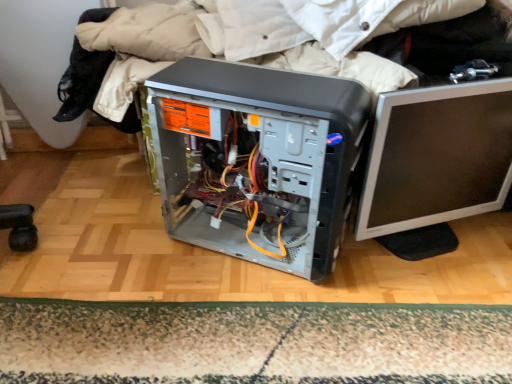
Question: Can you confirm if silver/black plastic monitor at right is taller than carpeted mat at lower center?

Choices:
 (A) yes
 (B) no

Answer: (A)

Question: From the image's perspective, does silver/black plastic monitor at right appear lower than carpeted mat at lower center?

Choices:
 (A) no
 (B) yes

Answer: (A)

Question: Does silver/black plastic monitor at right come in front of carpeted mat at lower center?

Choices:
 (A) yes
 (B) no

Answer: (A)

Question: Considering the relative sizes of silver/black plastic monitor at right and carpeted mat at lower center in the image provided, is silver/black plastic monitor at right smaller than carpeted mat at lower center?

Choices:
 (A) no
 (B) yes

Answer: (A)

Question: From a real-world perspective, is silver/black plastic monitor at right on carpeted mat at lower center?

Choices:
 (A) no
 (B) yes

Answer: (B)

Question: In terms of size, does silver/black plastic monitor at right appear bigger or smaller than satin black computer tower at center?

Choices:
 (A) big
 (B) small

Answer: (B)

Question: Does point (423, 233) appear closer or farther from the camera than point (261, 223)?

Choices:
 (A) farther
 (B) closer

Answer: (B)

Question: Is silver/black plastic monitor at right taller or shorter than satin black computer tower at center?

Choices:
 (A) short
 (B) tall

Answer: (A)

Question: Relative to satin black computer tower at center, is silver/black plastic monitor at right in front or behind?

Choices:
 (A) front
 (B) behind

Answer: (B)

Question: Is silver/black plastic monitor at right bigger or smaller than carpeted mat at lower center?

Choices:
 (A) big
 (B) small

Answer: (A)

Question: In terms of height, does silver/black plastic monitor at right look taller or shorter compared to carpeted mat at lower center?

Choices:
 (A) short
 (B) tall

Answer: (B)

Question: Is silver/black plastic monitor at right in front of or behind carpeted mat at lower center in the image?

Choices:
 (A) front
 (B) behind

Answer: (A)

Question: Do you think silver/black plastic monitor at right is within carpeted mat at lower center, or outside of it?

Choices:
 (A) outside
 (B) inside

Answer: (A)

Question: Considering the relative positions of satin black computer tower at center and carpeted mat at lower center in the image provided, is satin black computer tower at center to the left or to the right of carpeted mat at lower center?

Choices:
 (A) right
 (B) left

Answer: (A)

Question: Is point pyautogui.click(x=208, y=76) positioned closer to the camera than point pyautogui.click(x=352, y=352)?

Choices:
 (A) closer
 (B) farther

Answer: (B)